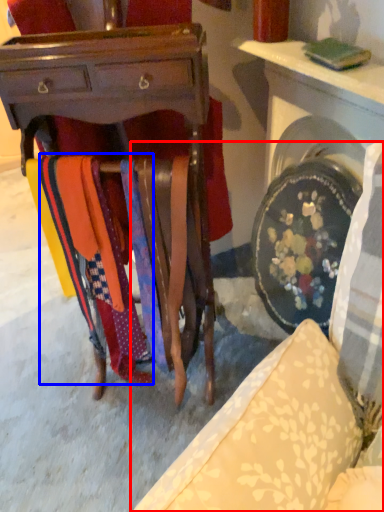
Question: Among these objects, which one is farthest to the camera, furniture (highlighted by a red box) or fabric (highlighted by a blue box)?

Choices:
 (A) furniture
 (B) fabric

Answer: (A)